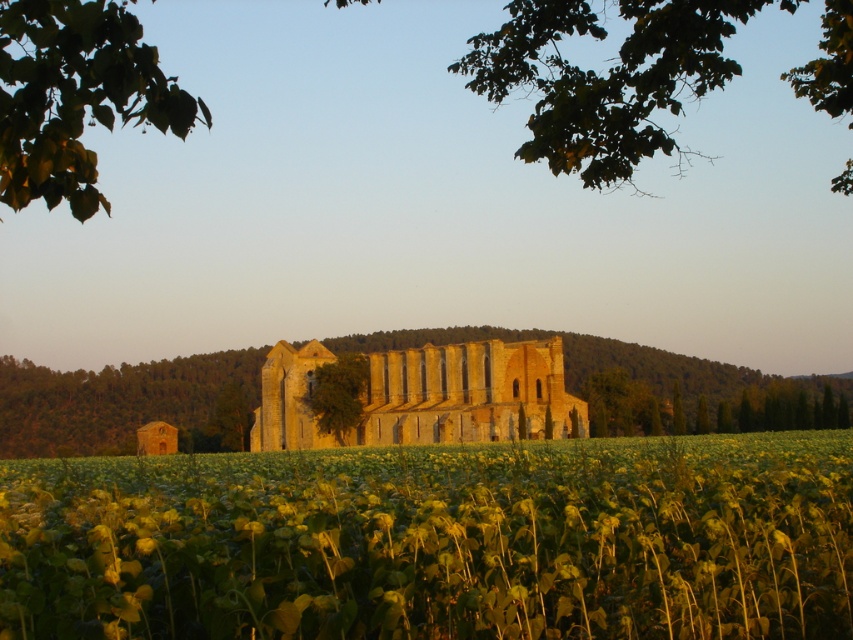
Measure the distance from green leafy branch at upper left to golden stone ruins at center.

A distance of 63.54 meters exists between green leafy branch at upper left and golden stone ruins at center.

Where is `green leafy branch at upper left`? green leafy branch at upper left is located at coordinates (74, 96).

Consider the image. Which of these two, green leafy branch at upper left or green leafy tree at center, stands taller?

With more height is green leafy branch at upper left.

Can you confirm if green leafy branch at upper left is taller than green leafy tree at center?

Correct, green leafy branch at upper left is much taller as green leafy tree at center.

Is point (115, 45) farther from viewer compared to point (332, 387)?

No, it is not.

You are a GUI agent. You are given a task and a screenshot of the screen. Output one action in this format:
    pyautogui.click(x=<x>, y=<y>)
    Task: Click on the green leafy branch at upper left
    This screenshot has height=640, width=853.
    Given the screenshot: What is the action you would take?
    pyautogui.click(x=74, y=96)

Does green leafy vineyard at center have a greater height compared to brown stone building at center?

No.

Is green leafy vineyard at center positioned in front of brown stone building at center?

Yes.

The height and width of the screenshot is (640, 853). Describe the element at coordinates (437, 541) in the screenshot. I see `green leafy vineyard at center` at that location.

Identify the location of green leafy vineyard at center. (437, 541).